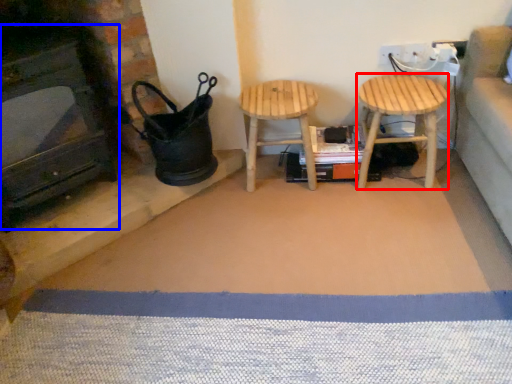
Question: Which object appears closest to the camera in this image, stool (highlighted by a red box) or fireplace (highlighted by a blue box)?

Choices:
 (A) stool
 (B) fireplace

Answer: (B)